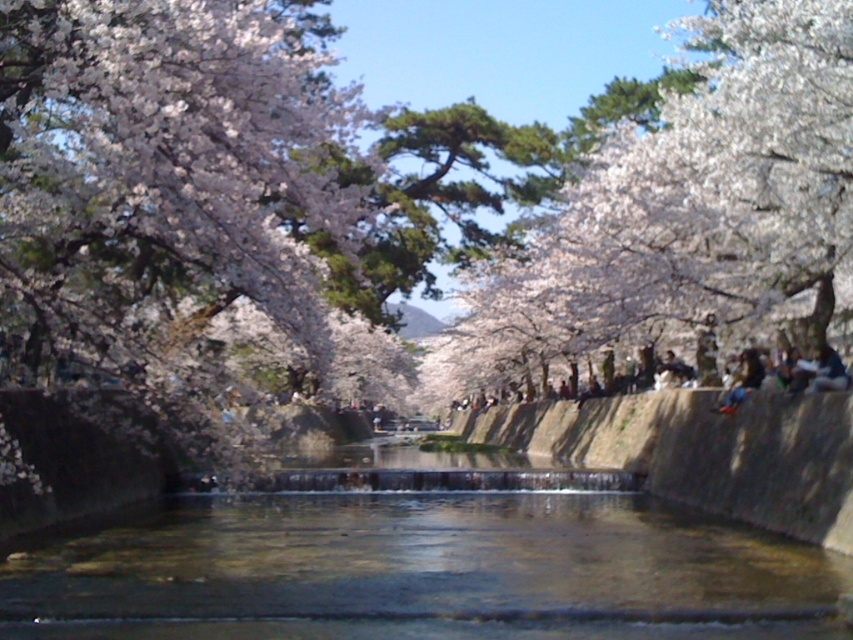
Question: Estimate the real-world distances between objects in this image. Which object is farther from the white blossoms at upper center?

Choices:
 (A) clear water at center
 (B) white blossoming tree at upper left

Answer: (A)

Question: Is white blossoming tree at upper left bigger than smooth concrete embankment at center?

Choices:
 (A) yes
 (B) no

Answer: (A)

Question: Does white blossoming tree at upper left have a smaller size compared to white blossoms at upper center?

Choices:
 (A) yes
 (B) no

Answer: (A)

Question: Among these objects, which one is farthest from the camera?

Choices:
 (A) white blossoming tree at upper left
 (B) smooth concrete embankment at center
 (C) white blossoms at upper center
 (D) clear water at center

Answer: (C)

Question: Is white blossoming tree at upper left to the left of white blossoms at upper center from the viewer's perspective?

Choices:
 (A) no
 (B) yes

Answer: (B)

Question: Among these points, which one is nearest to the camera?

Choices:
 (A) (16, 296)
 (B) (763, 436)
 (C) (39, 588)

Answer: (C)